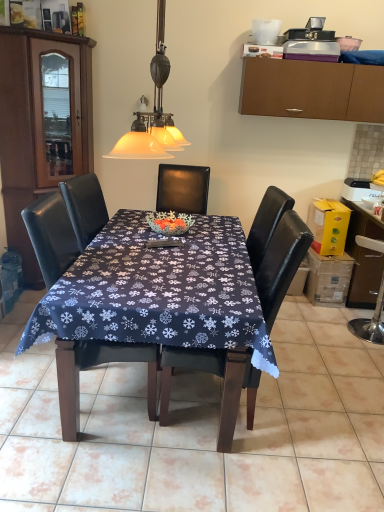
You are a GUI agent. You are given a task and a screenshot of the screen. Output one action in this format:
    pyautogui.click(x=<x>, y=<y>)
    Task: Click on the vacant point to the left of metallic silver swivel chair at right
    
    Given the screenshot: What is the action you would take?
    pyautogui.click(x=326, y=326)